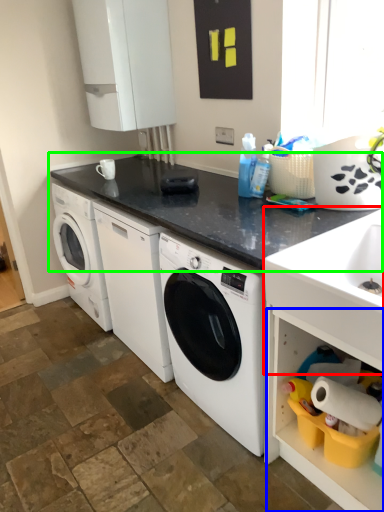
Question: Which object is the closest to the sink (highlighted by a red box)? Choose among these: shelf (highlighted by a blue box) or countertop (highlighted by a green box).

Choices:
 (A) shelf
 (B) countertop

Answer: (A)